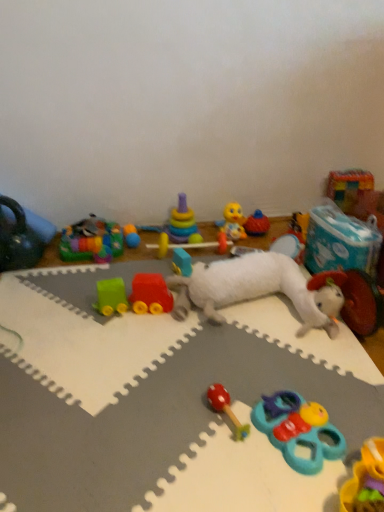
At what (x,y) coordinates should I click in order to perform the action: click on free point to the right of multicolored plastic rainbow at upper left, positioned as the 14th toy in right-to-left order. Please return your answer as a coordinate pair (x, y). This screenshot has width=384, height=512. Looking at the image, I should click on (145, 252).